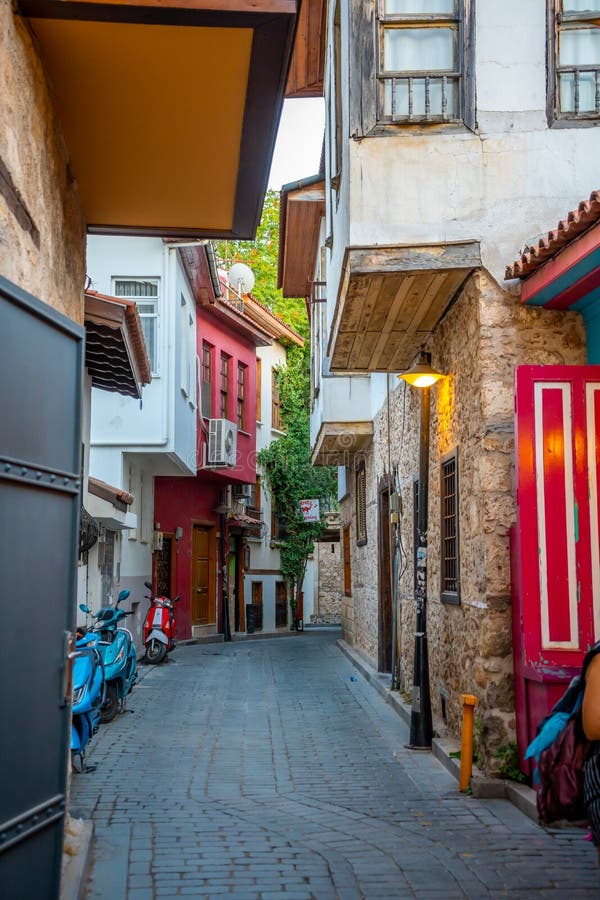
You are a GUI agent. You are given a task and a screenshot of the screen. Output one action in this format:
    pyautogui.click(x=<x>, y=<y>)
    Task: Click on the vent
    This screenshot has height=900, width=600.
    Given the screenshot: What is the action you would take?
    pyautogui.click(x=222, y=444)